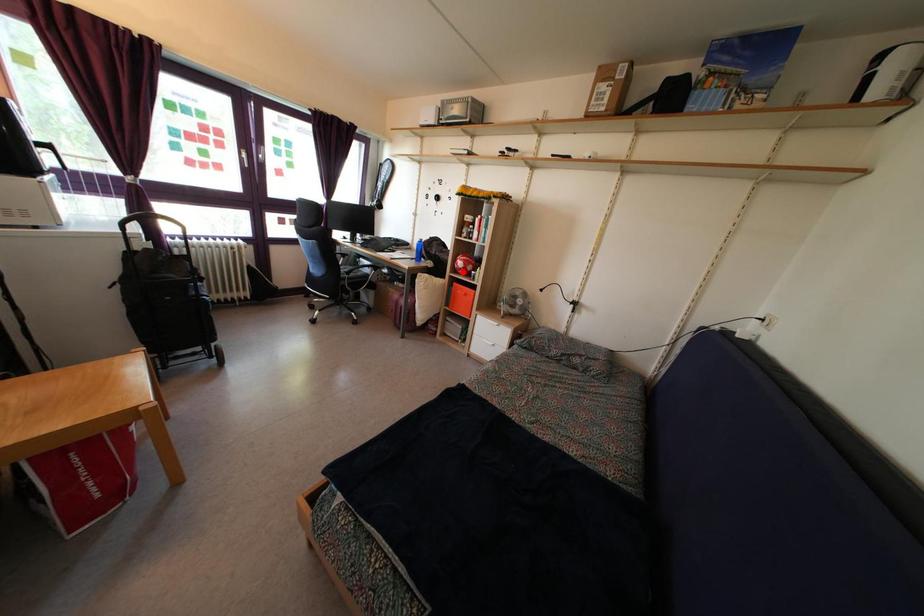
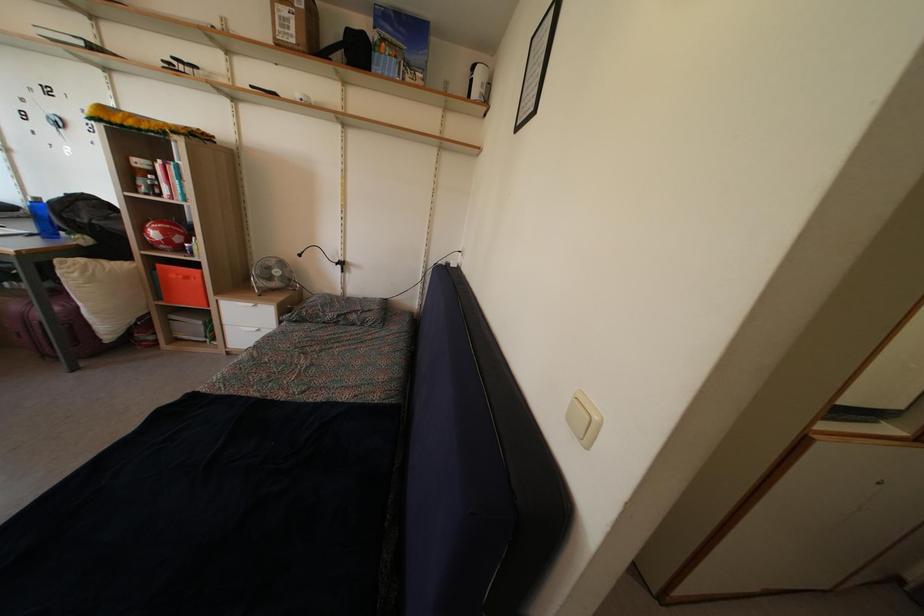
Where in the second image is the point corresponding to the highlighted location from the first image?

(157, 243)